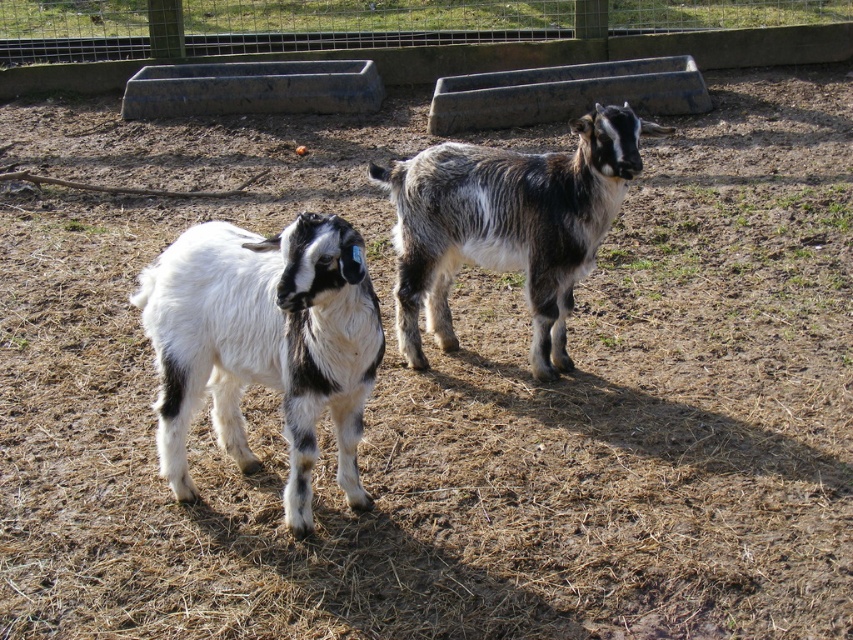
You are a farmer who needs to separate the two goats using a divider placed between them. Given their positions, where should you place the divider relative to the white woolen goat at center and the speckled woolen goat at center?

The divider should be placed between the white woolen goat at center and the speckled woolen goat at center, to the right of the white woolen goat at center since it is positioned on the left side of the speckled woolen goat at center.

You are a farmer checking on your goats in the enclosure. You see the white woolen goat at center and the speckled woolen goat at center. Which goat is closer to you?

The white woolen goat at center is closer to the viewer than the speckled woolen goat at center.